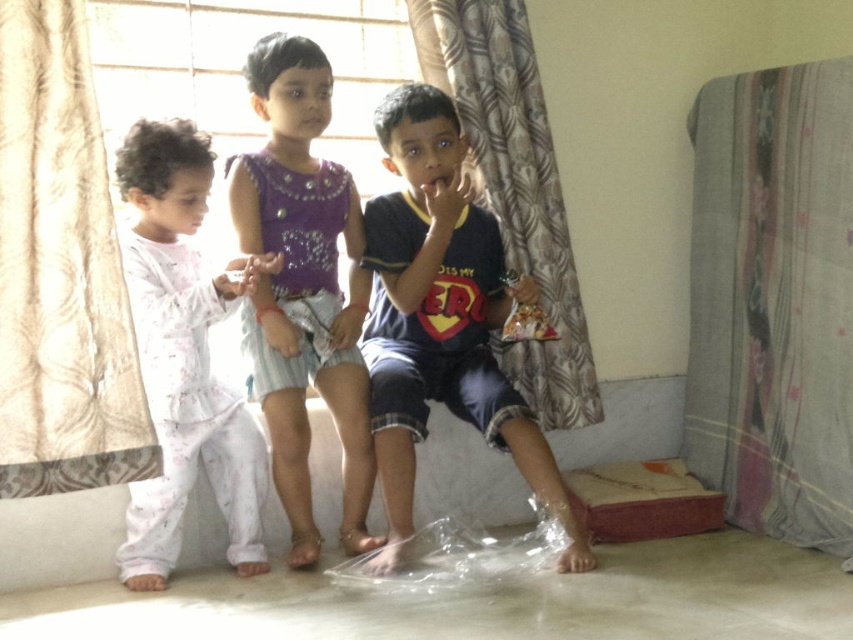
Who is taller, purple sequined dress at center or patterned fabric curtain at center?

purple sequined dress at center is taller.

Is purple sequined dress at center shorter than patterned fabric curtain at center?

No, purple sequined dress at center is not shorter than patterned fabric curtain at center.

Image resolution: width=853 pixels, height=640 pixels. I want to click on purple sequined dress at center, so click(x=303, y=288).

Is floral fabric curtain at right smaller than purple sequined dress at center?

Actually, floral fabric curtain at right might be larger than purple sequined dress at center.

Who is higher up, floral fabric curtain at right or purple sequined dress at center?

floral fabric curtain at right

Describe the element at coordinates (773, 300) in the screenshot. Image resolution: width=853 pixels, height=640 pixels. I see `floral fabric curtain at right` at that location.

The height and width of the screenshot is (640, 853). In order to click on floral fabric curtain at right in this screenshot , I will do `click(773, 300)`.

Which is in front, point (49, 310) or point (442, 304)?

Point (49, 310) is more forward.

From the picture: Who is positioned more to the right, beige floral curtain at left or dark blue jersey at center?

Positioned to the right is dark blue jersey at center.

Where is `beige floral curtain at left`? beige floral curtain at left is located at coordinates (61, 272).

Where is `beige floral curtain at left`? The width and height of the screenshot is (853, 640). beige floral curtain at left is located at coordinates (61, 272).